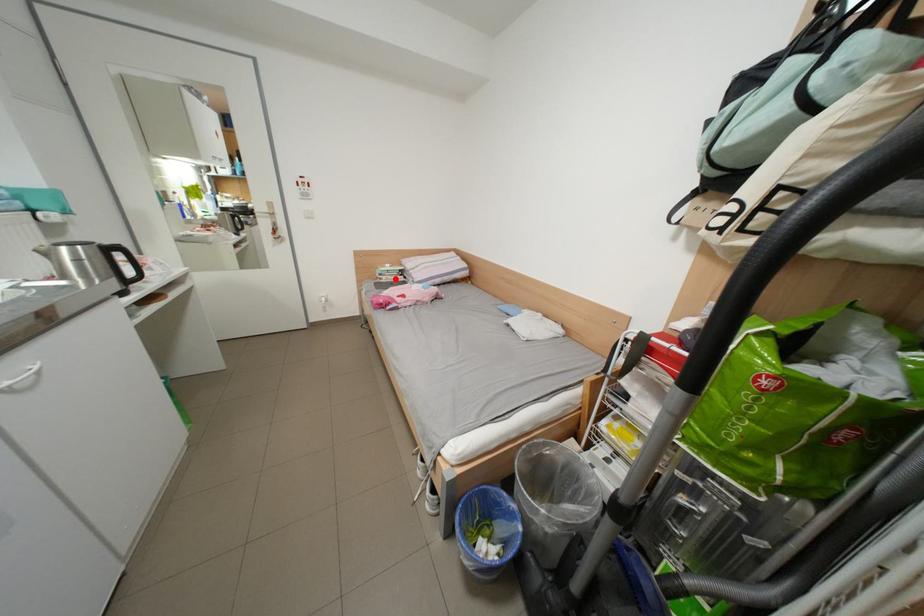
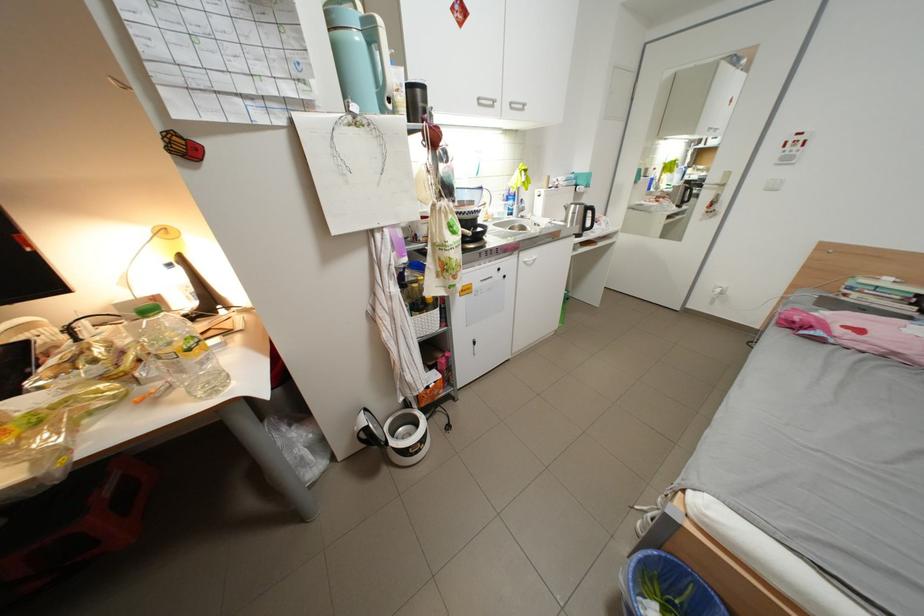
Where in the second image is the point corresponding to the highlighted location from the first image?

(867, 296)